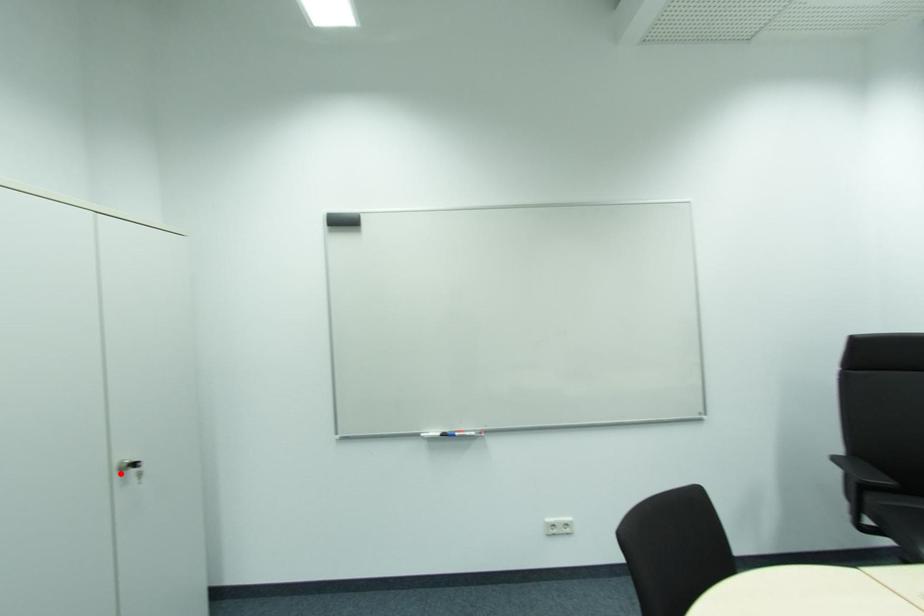
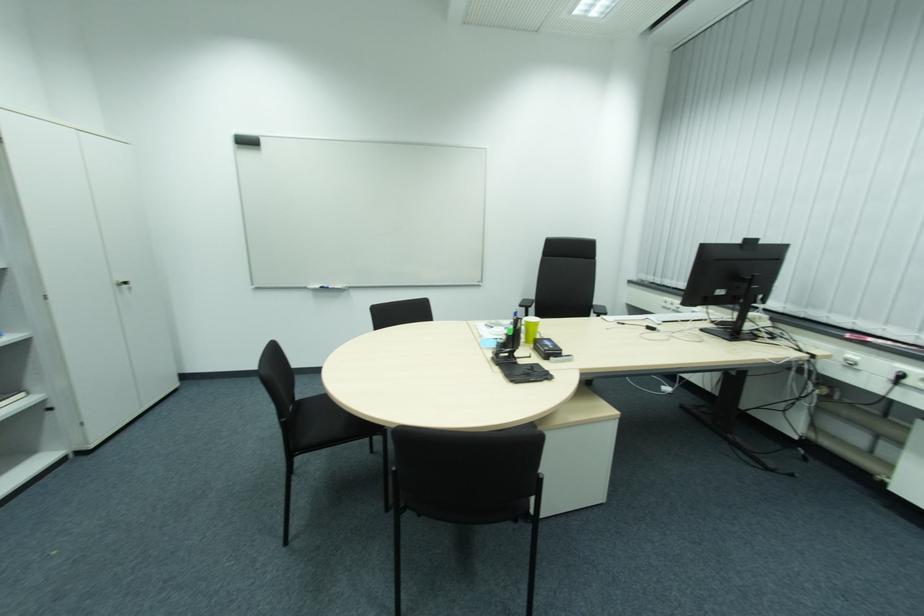
Where in the second image is the point corresponding to the highlighted location from the first image?

(122, 286)